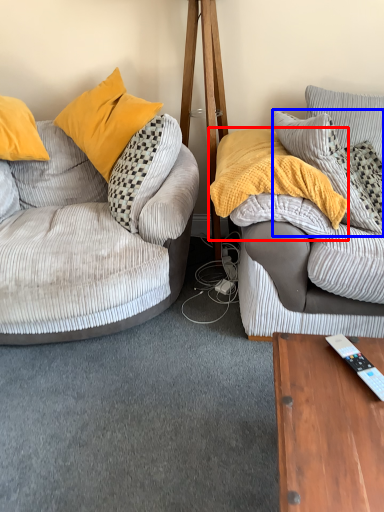
Question: Among these objects, which one is farthest to the camera, material (highlighted by a red box) or pillow (highlighted by a blue box)?

Choices:
 (A) material
 (B) pillow

Answer: (B)